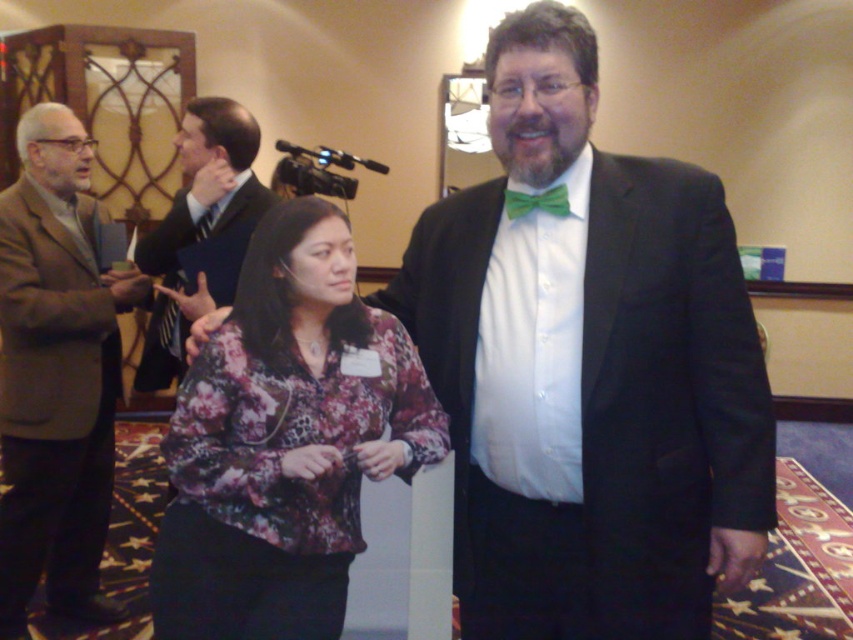
You are a photographer at the event and need to decide where to place your equipment. The black plastic video camera at upper center and the green satin bow tie at center are in your line of sight. Which object takes up more space in your view?

The black plastic video camera at upper center is bigger than the green satin bow tie at center, so it takes up more space in your view.

You are a photographer at the event and need to capture a clear shot of the dark blue sweater at center without the black plastic video camera at upper center blocking the view. Is this possible given their positions?

The dark blue sweater at center is below the black plastic video camera at upper center, so adjusting the camera angle downward might allow capturing the sweater without obstruction from the camera.